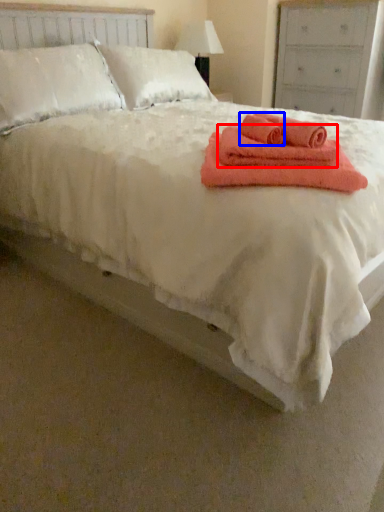
Question: Among these objects, which one is farthest to the camera, bath towel (highlighted by a red box) or bath towel (highlighted by a blue box)?

Choices:
 (A) bath towel
 (B) bath towel

Answer: (B)